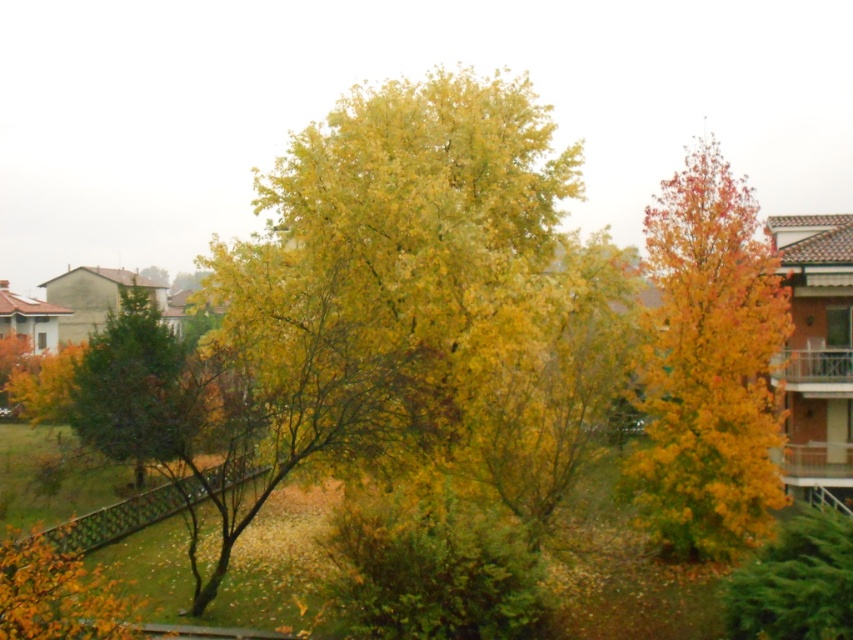
Does orange-brown textured tree at right have a greater height compared to green matte tree at center?

Indeed, orange-brown textured tree at right has a greater height compared to green matte tree at center.

Who is more forward, [741,259] or [120,321]?

Point [741,259]

Where is `orange-brown textured tree at right`? This screenshot has width=853, height=640. orange-brown textured tree at right is located at coordinates (709, 368).